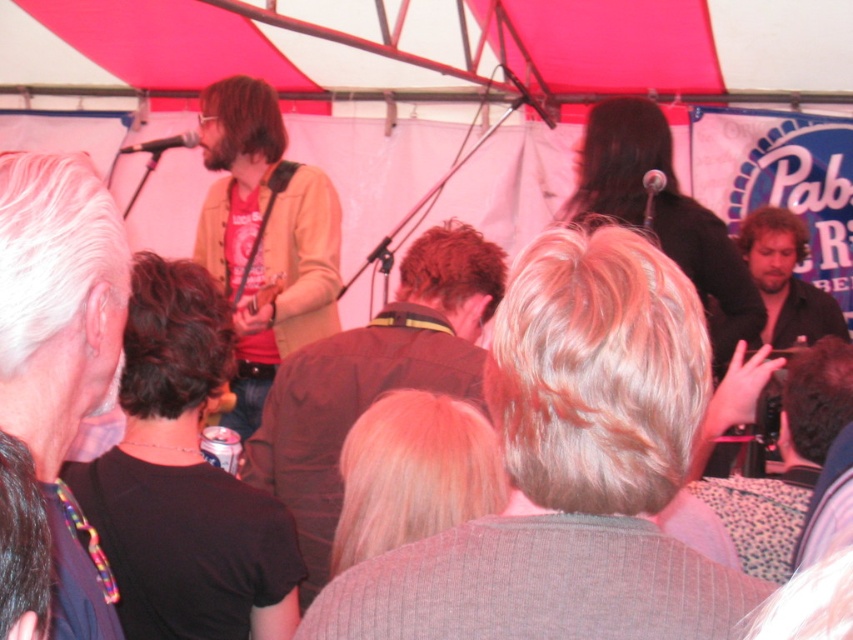
You are a photographer standing at the front of the stage. You want to take a photo that includes both point A at point (47, 256) and point B at point (459, 221). Which point should you focus on first to ensure both are in sharp focus?

You should focus on point A at point (47, 256) first because it is closer to the camera than point B at point (459, 221). This ensures that both points will be in focus as the camera adjusts depth of field.

You are a photographer at the music event. You want to take a photo of the gray hair at left. Where should you aim your camera to capture it?

You should aim your camera at point 0.547 on the x axis and 0.073 on the y axis to capture the gray hair at left.